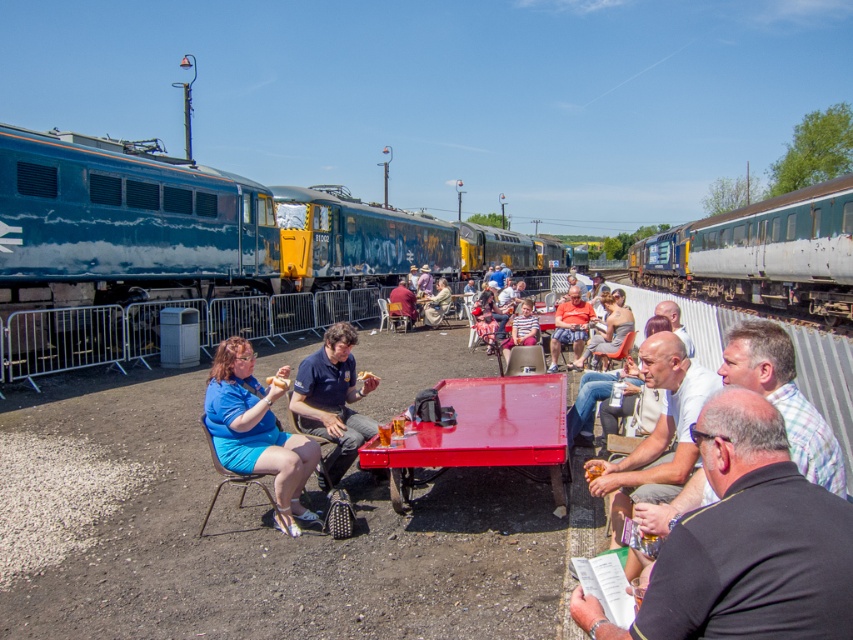
Consider the image. You are standing at the point labeled as point (579, 320) and want to move to the point labeled as point (206, 173). Based on the scene, which direction should you walk to reach your destination?

To reach point (206, 173) from point (579, 320), you should walk towards the direction of the red rectangular table since point (206, 173) is behind point (579, 320), implying it is located in the opposite direction from where you are facing.

You are a photographer standing at the scene. You want to take a photo that includes both the teal glossy locomotive at left and the orange fabric shorts at center. Which object should be placed on the right side of the other in the frame?

The teal glossy locomotive at left is positioned on the right side of orange fabric shorts at center, so in the frame, the teal glossy locomotive at left should be on the right side of the orange fabric shorts at center.

You are a photographer at the railway station scene. You need to capture a group photo of the two people wearing the dark gray shirt at center and the matte black jacket at center. Which person should you position closer to the camera to ensure their full body is visible in the photo?

The dark gray shirt at center should be positioned closer to the camera because their width surpasses that of the matte black jacket at center, making them appear larger in the photo when closer.